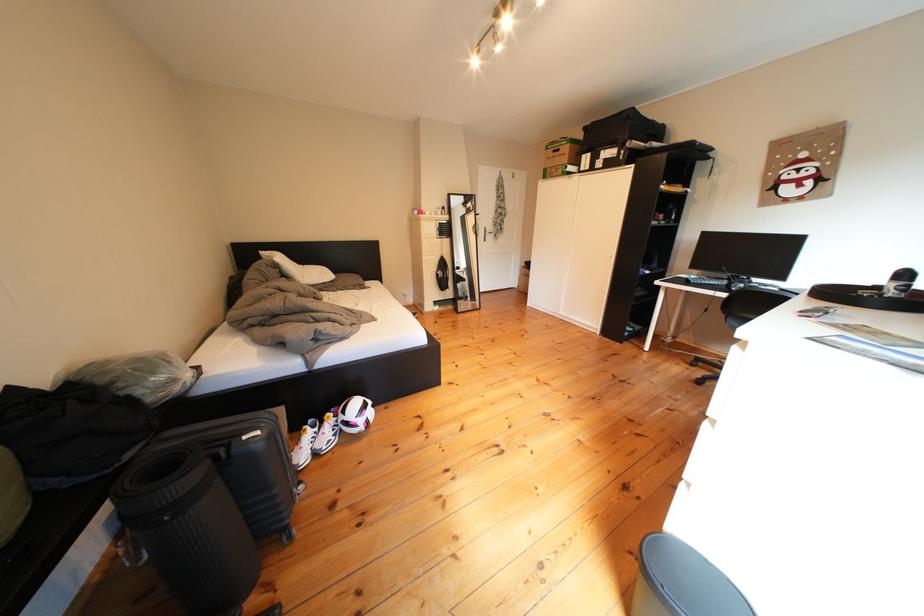
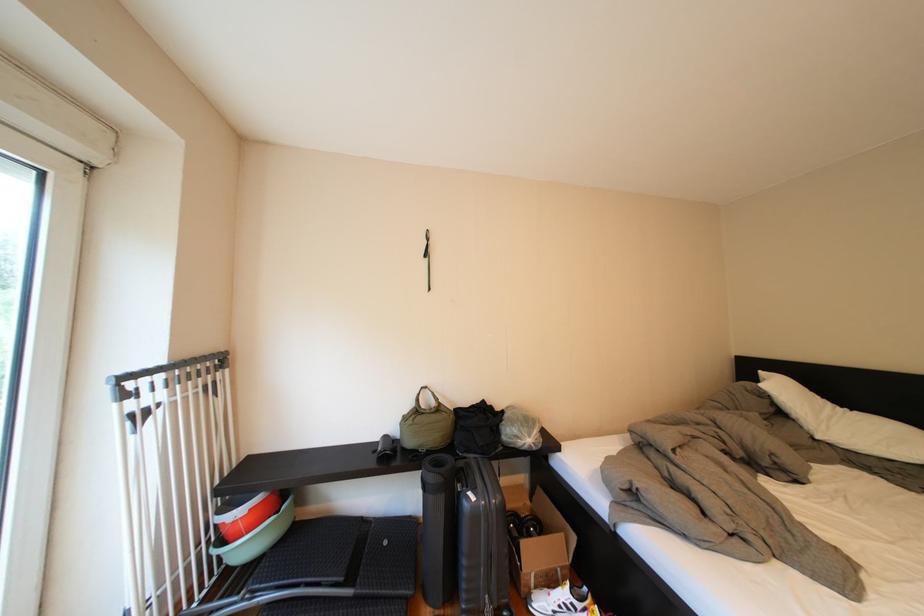
Where in the second image is the point corresponding to the point at 298,281 from the first image?

(795, 419)